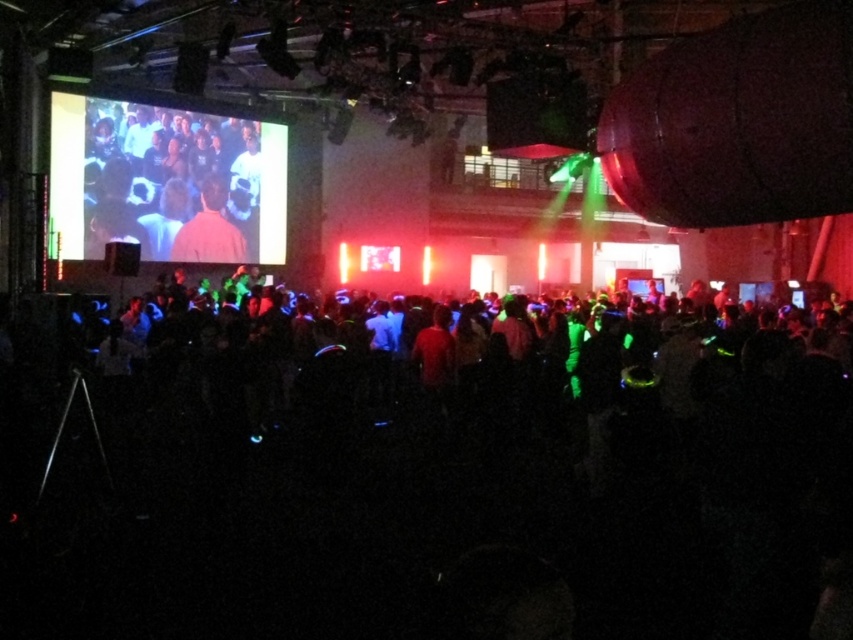
Question: Among these objects, which one is nearest to the camera?

Choices:
 (A) matte black shirt at upper left
 (B) neon green glowing crowd at center
 (C) matte brown shirt at center

Answer: (B)

Question: From the image, what is the correct spatial relationship of neon green glowing crowd at center in relation to matte black shirt at upper left?

Choices:
 (A) right
 (B) left

Answer: (A)

Question: Based on their relative distances, which object is nearer to the neon green glowing crowd at center?

Choices:
 (A) matte brown shirt at center
 (B) matte black shirt at upper left

Answer: (B)

Question: Which of the following is the closest to the observer?

Choices:
 (A) (508, 460)
 (B) (206, 228)
 (C) (213, 241)

Answer: (A)

Question: Where is neon green glowing crowd at center located in relation to matte brown shirt at center in the image?

Choices:
 (A) left
 (B) right

Answer: (B)

Question: Can you confirm if matte black shirt at upper left is positioned above matte brown shirt at center?

Choices:
 (A) yes
 (B) no

Answer: (A)